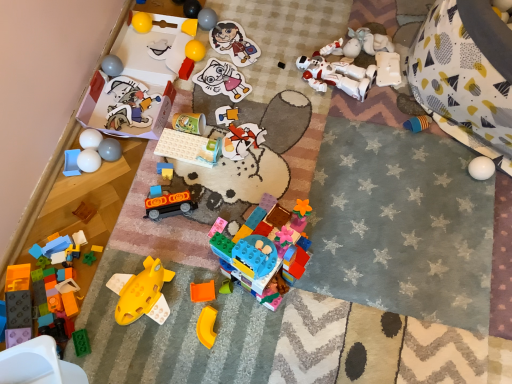
Image resolution: width=512 pixels, height=384 pixels. Identify the location of vacant space that is to the left of white matte robot at center, marked as the third toy in a right-to-left arrangement. (270, 78).